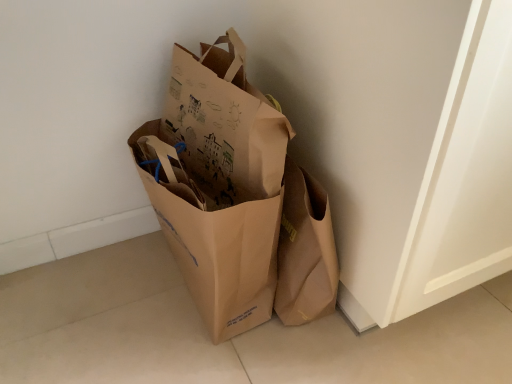
Locate an element on the screen. vacant space to the left of brown paper bags at lower left is located at coordinates (95, 302).